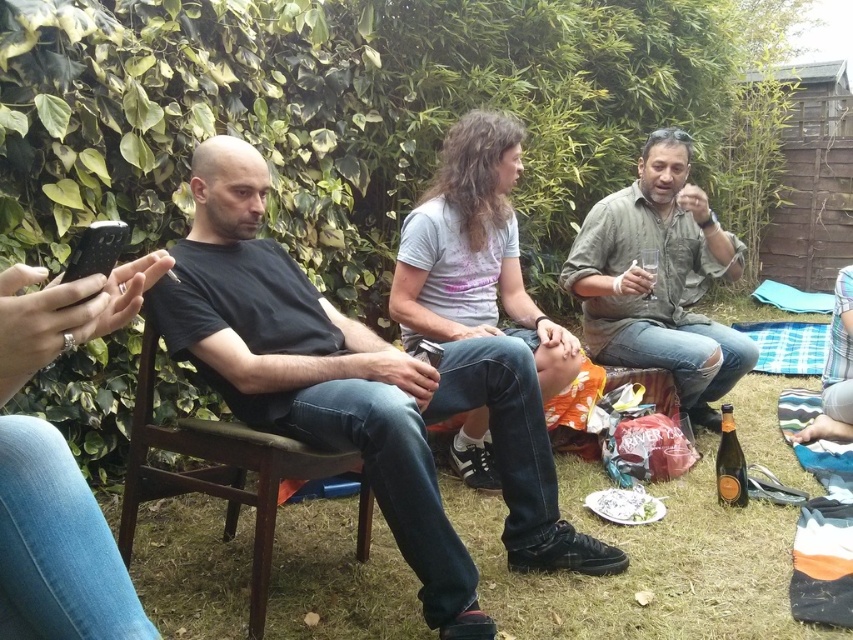
You are standing in the backyard and want to place a small potted plant between the two points, point (519, 353) and point (590, 291). Which point should the plant be closer to in order to be in the foreground?

The plant should be placed closer to point (519, 353) because it is closer to the camera than point (590, 291).